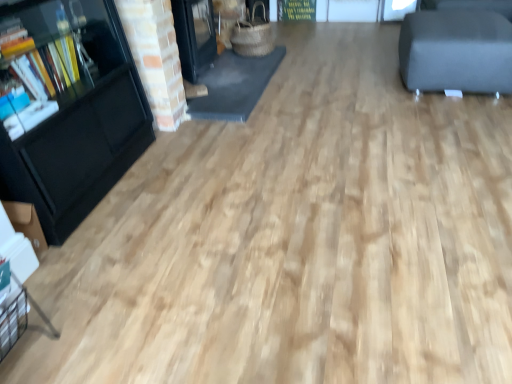
Describe the element at coordinates (67, 108) in the screenshot. I see `black glossy bookcase at left` at that location.

What is the approximate height of black glossy bookcase at left?

black glossy bookcase at left is 85.79 centimeters in height.

The width and height of the screenshot is (512, 384). I want to click on black glossy bookcase at left, so click(67, 108).

At what (x,y) coordinates should I click in order to perform the action: click on dark gray fabric ottoman at upper right. Please return your answer as a coordinate pair (x, y). The height and width of the screenshot is (384, 512). Looking at the image, I should click on (456, 51).

This screenshot has height=384, width=512. What do you see at coordinates (456, 51) in the screenshot?
I see `dark gray fabric ottoman at upper right` at bounding box center [456, 51].

Looking at this image, measure the distance between point (495, 35) and camera.

The depth of point (495, 35) is 8.36 feet.

The width and height of the screenshot is (512, 384). In order to click on black glossy bookcase at left in this screenshot , I will do `click(67, 108)`.

Which object is positioned more to the left, black glossy bookcase at left or dark gray fabric ottoman at upper right?

black glossy bookcase at left.

Is black glossy bookcase at left in front of or behind dark gray fabric ottoman at upper right in the image?

Clearly, black glossy bookcase at left is in front of dark gray fabric ottoman at upper right.

Does point (41, 151) appear closer or farther from the camera than point (442, 45)?

Point (41, 151) is positioned closer to the camera compared to point (442, 45).

Looking at this image, from the image's perspective, is black glossy bookcase at left above dark gray fabric ottoman at upper right?

Actually, black glossy bookcase at left appears below dark gray fabric ottoman at upper right in the image.

From a real-world perspective, relative to dark gray fabric ottoman at upper right, is black glossy bookcase at left vertically above or below?

From a real-world perspective, black glossy bookcase at left is physically above dark gray fabric ottoman at upper right.

Does black glossy bookcase at left have a lesser width compared to dark gray fabric ottoman at upper right?

Yes, black glossy bookcase at left is thinner than dark gray fabric ottoman at upper right.

Is black glossy bookcase at left shorter than dark gray fabric ottoman at upper right?

No, black glossy bookcase at left is not shorter than dark gray fabric ottoman at upper right.

Does black glossy bookcase at left have a smaller size compared to dark gray fabric ottoman at upper right?

No.

Is dark gray fabric ottoman at upper right surrounded by black glossy bookcase at left?

No, dark gray fabric ottoman at upper right is not a part of black glossy bookcase at left.

Is black glossy bookcase at left next to dark gray fabric ottoman at upper right and touching it?

There is a gap between black glossy bookcase at left and dark gray fabric ottoman at upper right.

Is black glossy bookcase at left turned away from dark gray fabric ottoman at upper right?

black glossy bookcase at left does not have its back to dark gray fabric ottoman at upper right.

What's the angular difference between black glossy bookcase at left and dark gray fabric ottoman at upper right's facing directions?

They differ by 179 degrees in their facing directions.

What are the coordinates of `furniture below the black glossy bookcase at left (from a real-world perspective)` in the screenshot? It's located at (456, 51).

Considering the relative positions of dark gray fabric ottoman at upper right and black glossy bookcase at left in the image provided, is dark gray fabric ottoman at upper right to the right of black glossy bookcase at left from the viewer's perspective?

Correct, you'll find dark gray fabric ottoman at upper right to the right of black glossy bookcase at left.

Considering their positions, is dark gray fabric ottoman at upper right located in front of or behind black glossy bookcase at left?

In the image, dark gray fabric ottoman at upper right appears behind black glossy bookcase at left.

Is point (426, 76) closer to viewer compared to point (124, 136)?

No.

From the image's perspective, would you say dark gray fabric ottoman at upper right is positioned over black glossy bookcase at left?

Yes, from the image's perspective, dark gray fabric ottoman at upper right is on top of black glossy bookcase at left.

From a real-world perspective, is dark gray fabric ottoman at upper right physically below black glossy bookcase at left?

Yes, from a real-world perspective, dark gray fabric ottoman at upper right is beneath black glossy bookcase at left.

In terms of width, does dark gray fabric ottoman at upper right look wider or thinner when compared to black glossy bookcase at left?

Considering their sizes, dark gray fabric ottoman at upper right looks broader than black glossy bookcase at left.

Who is taller, dark gray fabric ottoman at upper right or black glossy bookcase at left?

black glossy bookcase at left is taller.

Considering the sizes of dark gray fabric ottoman at upper right and black glossy bookcase at left in the image, is dark gray fabric ottoman at upper right bigger or smaller than black glossy bookcase at left?

dark gray fabric ottoman at upper right is smaller than black glossy bookcase at left.

Choose the correct answer: Is dark gray fabric ottoman at upper right inside black glossy bookcase at left or outside it?

dark gray fabric ottoman at upper right exists outside the volume of black glossy bookcase at left.

Are dark gray fabric ottoman at upper right and black glossy bookcase at left located far from each other?

Indeed, dark gray fabric ottoman at upper right is not near black glossy bookcase at left.

Is dark gray fabric ottoman at upper right looking in the opposite direction of black glossy bookcase at left?

No, dark gray fabric ottoman at upper right's orientation is not away from black glossy bookcase at left.

Can you tell me how much dark gray fabric ottoman at upper right and black glossy bookcase at left differ in facing direction?

179 degrees separate the facing orientations of dark gray fabric ottoman at upper right and black glossy bookcase at left.

At what (x,y) coordinates should I click in order to perform the action: click on bookcase below the dark gray fabric ottoman at upper right (from the image's perspective). Please return your answer as a coordinate pair (x, y). This screenshot has width=512, height=384. Looking at the image, I should click on (67, 108).

I want to click on bookcase in front of the dark gray fabric ottoman at upper right, so click(x=67, y=108).

Locate an element on the screen. The height and width of the screenshot is (384, 512). bookcase below the dark gray fabric ottoman at upper right (from the image's perspective) is located at coordinates (67, 108).